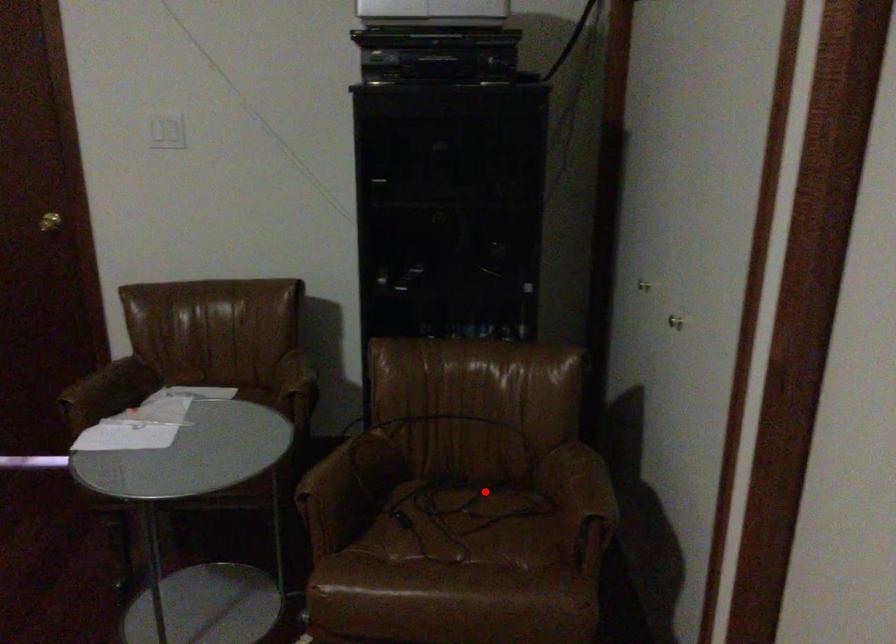
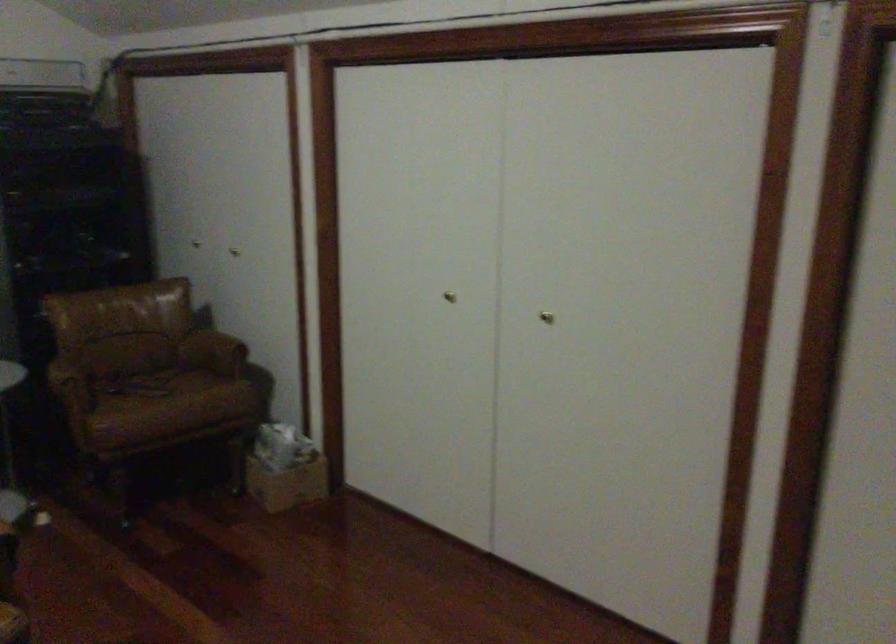
Question: I am providing you with two images of the same scene from different viewpoints. A red point is shown in image1. For the corresponding object point in image2, is it positioned nearer or farther from the camera?

Choices:
 (A) Nearer
 (B) Farther

Answer: (B)